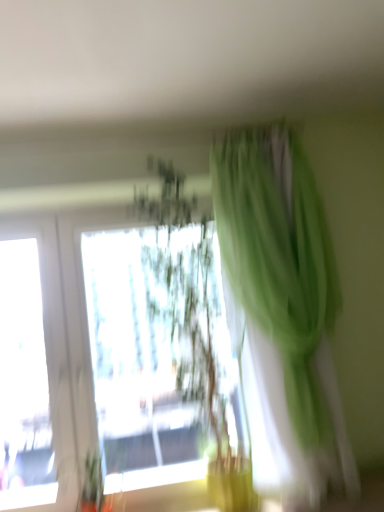
Question: Should I look upward or downward to see green sheer curtain at upper right?

Choices:
 (A) down
 (B) up

Answer: (A)

Question: Is green sheer curtain at upper right not within translucent green plant at center?

Choices:
 (A) no
 (B) yes

Answer: (B)

Question: Could you tell me if green sheer curtain at upper right is facing translucent green plant at center?

Choices:
 (A) no
 (B) yes

Answer: (A)

Question: Are green sheer curtain at upper right and translucent green plant at center located far from each other?

Choices:
 (A) no
 (B) yes

Answer: (A)

Question: Is green sheer curtain at upper right smaller than translucent green plant at center?

Choices:
 (A) no
 (B) yes

Answer: (B)

Question: Does green sheer curtain at upper right appear on the left side of translucent green plant at center?

Choices:
 (A) yes
 (B) no

Answer: (B)

Question: Does green sheer curtain at upper right have a greater width compared to translucent green plant at center?

Choices:
 (A) yes
 (B) no

Answer: (B)

Question: Is translucent green plant at center smaller than green sheer curtain at upper right?

Choices:
 (A) yes
 (B) no

Answer: (B)

Question: Is translucent green plant at center not within green sheer curtain at upper right?

Choices:
 (A) yes
 (B) no

Answer: (A)

Question: Is translucent green plant at center further to camera compared to green sheer curtain at upper right?

Choices:
 (A) no
 (B) yes

Answer: (B)

Question: From a real-world perspective, is translucent green plant at center over green sheer curtain at upper right?

Choices:
 (A) yes
 (B) no

Answer: (B)

Question: Is translucent green plant at center thinner than green sheer curtain at upper right?

Choices:
 (A) no
 (B) yes

Answer: (A)

Question: From the image's perspective, does translucent green plant at center appear lower than green sheer curtain at upper right?

Choices:
 (A) no
 (B) yes

Answer: (B)

Question: From the image's perspective, is green sheer curtain at upper right positioned above or below translucent green plant at center?

Choices:
 (A) above
 (B) below

Answer: (A)